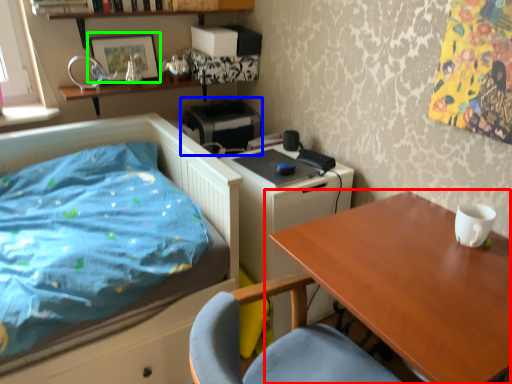
Question: Estimate the real-world distances between objects in this image. Which object is farther from table (highlighted by a red box), printer (highlighted by a blue box) or picture frame (highlighted by a green box)?

Choices:
 (A) printer
 (B) picture frame

Answer: (B)